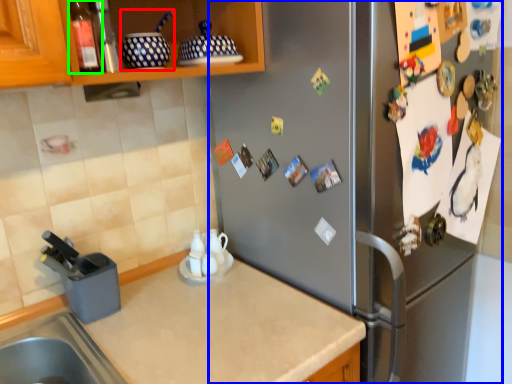
Question: Which is farther away from appliance (highlighted by a red box)? fridge (highlighted by a blue box) or bottle (highlighted by a green box)?

Choices:
 (A) fridge
 (B) bottle

Answer: (A)